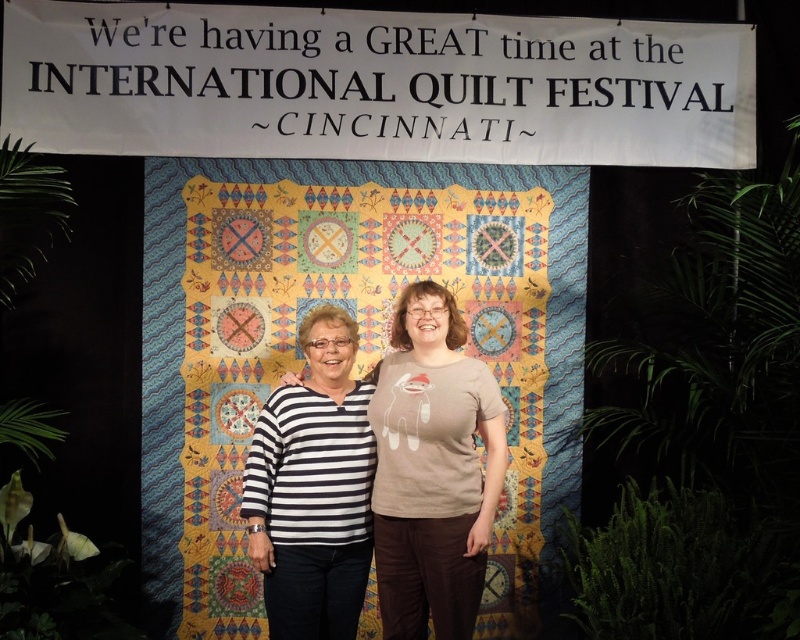
Question: Does multicolored fabric quilt at center have a larger size compared to white paper at upper center?

Choices:
 (A) no
 (B) yes

Answer: (B)

Question: Is white paper at upper center above black and white striped shirt at center?

Choices:
 (A) yes
 (B) no

Answer: (A)

Question: Does green leafy plant at right appear under matte beige t-shirt at center?

Choices:
 (A) yes
 (B) no

Answer: (B)

Question: Estimate the real-world distances between objects in this image. Which object is closer to the white paper at upper center?

Choices:
 (A) multicolored fabric quilt at center
 (B) matte beige t-shirt at center
 (C) green leafy plant at right
 (D) black and white striped shirt at center

Answer: (A)

Question: Which object is positioned closest to the matte beige t-shirt at center?

Choices:
 (A) green leafy plant at right
 (B) white paper at upper center
 (C) multicolored fabric quilt at center
 (D) black and white striped shirt at center

Answer: (D)

Question: Among these objects, which one is nearest to the camera?

Choices:
 (A) multicolored fabric quilt at center
 (B) white paper at upper center
 (C) matte beige t-shirt at center

Answer: (C)